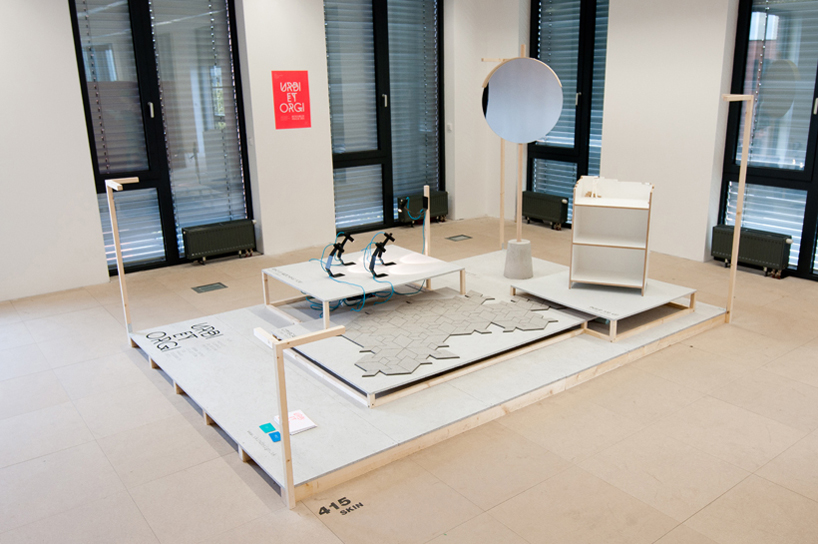
This screenshot has height=544, width=818. Identify the location of empty space on table. (316, 283).